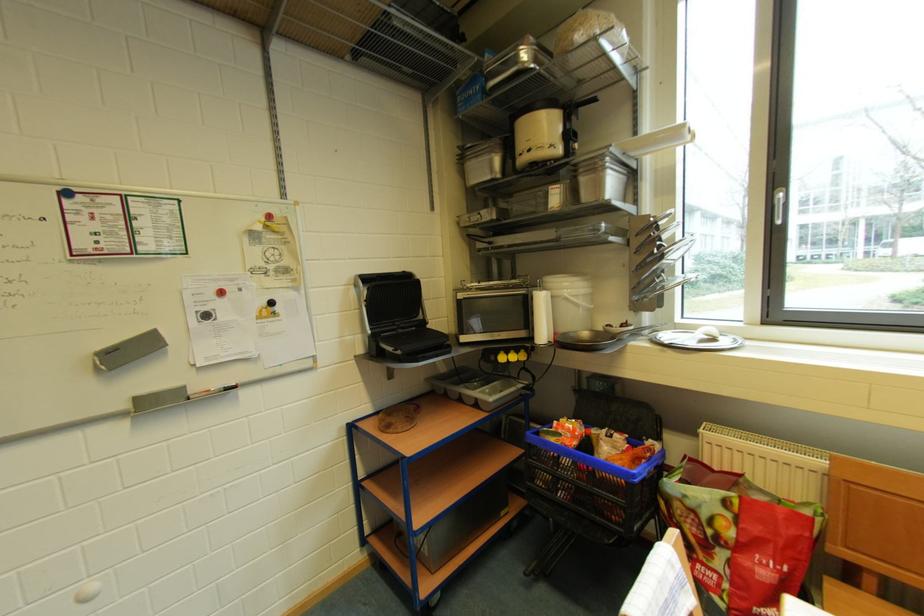
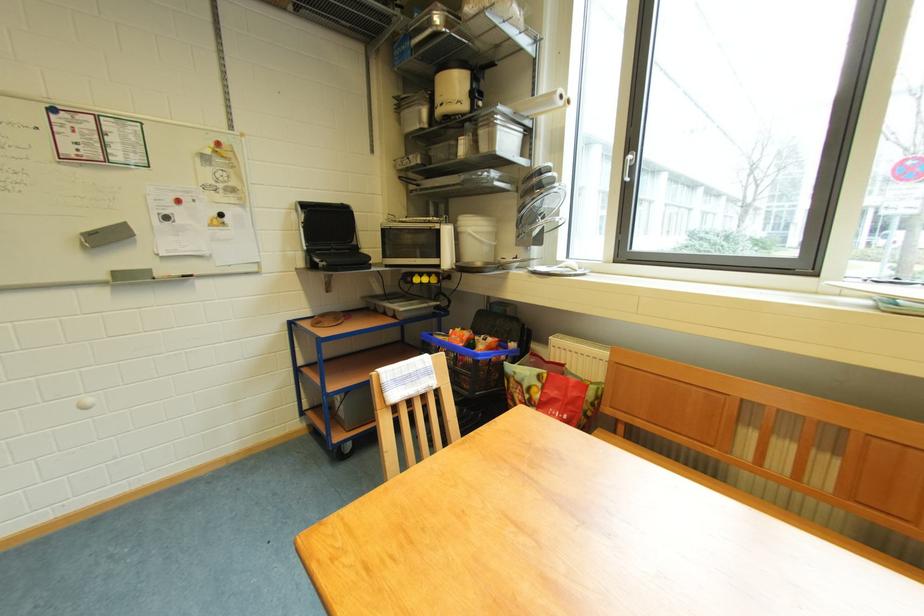
Where in the second image is the point corresponding to [466,301] from the first image?

(390, 230)